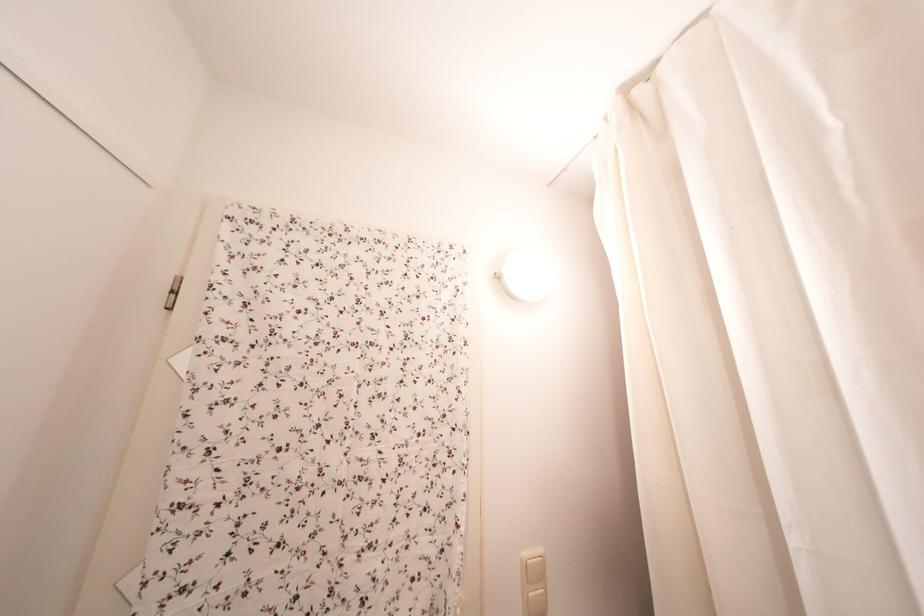
This screenshot has width=924, height=616. I want to click on white pull tab, so click(x=533, y=582).